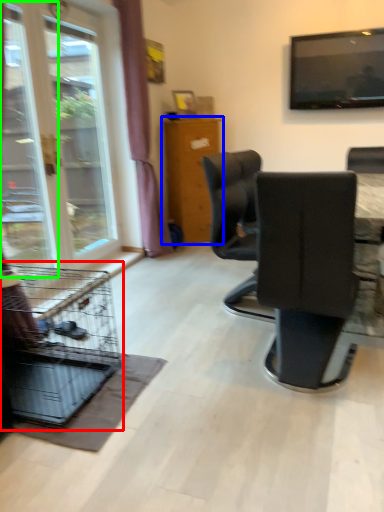
Question: Based on their relative distances, which object is farther from bird cage (highlighted by a red box)? Choose from furniture (highlighted by a blue box) and screen door (highlighted by a green box).

Choices:
 (A) furniture
 (B) screen door

Answer: (A)